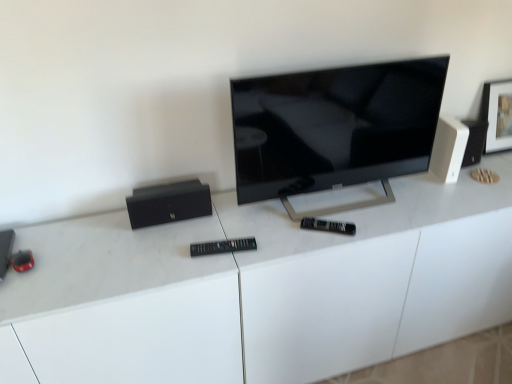
Locate an element on the screen. This screenshot has width=512, height=384. vacant space to the left of black plastic remote at center is located at coordinates (170, 256).